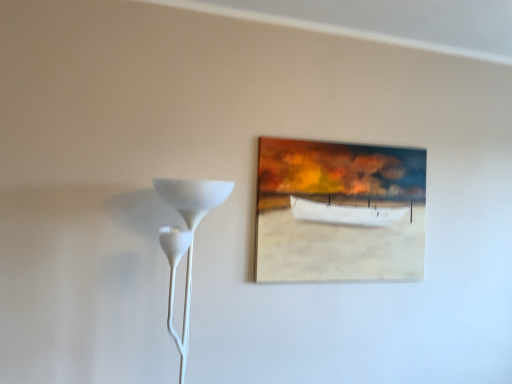
Question: Does oil painting boat at upper center have a greater height compared to white matte floor lamp at left?

Choices:
 (A) no
 (B) yes

Answer: (A)

Question: Considering the relative sizes of oil painting boat at upper center and white matte floor lamp at left in the image provided, is oil painting boat at upper center wider than white matte floor lamp at left?

Choices:
 (A) yes
 (B) no

Answer: (B)

Question: Is white matte floor lamp at left a part of oil painting boat at upper center?

Choices:
 (A) yes
 (B) no

Answer: (B)

Question: Can you confirm if oil painting boat at upper center is smaller than white matte floor lamp at left?

Choices:
 (A) yes
 (B) no

Answer: (A)

Question: Does oil painting boat at upper center have a lesser width compared to white matte floor lamp at left?

Choices:
 (A) no
 (B) yes

Answer: (B)

Question: Considering the relative positions of oil painting boat at upper center and white matte floor lamp at left in the image provided, is oil painting boat at upper center in front of white matte floor lamp at left?

Choices:
 (A) yes
 (B) no

Answer: (B)

Question: Does white matte floor lamp at left have a greater width compared to oil painting boat at upper center?

Choices:
 (A) no
 (B) yes

Answer: (B)

Question: Considering the relative sizes of white matte floor lamp at left and oil painting boat at upper center in the image provided, is white matte floor lamp at left taller than oil painting boat at upper center?

Choices:
 (A) yes
 (B) no

Answer: (A)

Question: Does white matte floor lamp at left contain oil painting boat at upper center?

Choices:
 (A) no
 (B) yes

Answer: (A)

Question: Is white matte floor lamp at left not near oil painting boat at upper center?

Choices:
 (A) no
 (B) yes

Answer: (A)

Question: Does white matte floor lamp at left have a smaller size compared to oil painting boat at upper center?

Choices:
 (A) no
 (B) yes

Answer: (A)

Question: Is white matte floor lamp at left next to oil painting boat at upper center?

Choices:
 (A) yes
 (B) no

Answer: (B)

Question: In the image, is white matte floor lamp at left positioned in front of or behind oil painting boat at upper center?

Choices:
 (A) behind
 (B) front

Answer: (B)